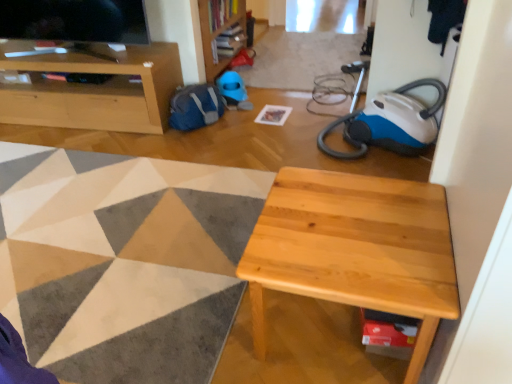
Question: Is wooden bookshelf at upper center smaller than matte wood cabinet at upper left?

Choices:
 (A) yes
 (B) no

Answer: (A)

Question: From a real-world perspective, does wooden bookshelf at upper center stand above matte wood cabinet at upper left?

Choices:
 (A) yes
 (B) no

Answer: (A)

Question: From the image's perspective, would you say wooden bookshelf at upper center is positioned over matte wood cabinet at upper left?

Choices:
 (A) yes
 (B) no

Answer: (A)

Question: Does wooden bookshelf at upper center have a lesser width compared to matte wood cabinet at upper left?

Choices:
 (A) yes
 (B) no

Answer: (A)

Question: Is wooden bookshelf at upper center taller than matte wood cabinet at upper left?

Choices:
 (A) yes
 (B) no

Answer: (A)

Question: In terms of height, does natural wood table at center look taller or shorter compared to matte wood cabinet at upper left?

Choices:
 (A) short
 (B) tall

Answer: (A)

Question: Is point (376, 301) positioned closer to the camera than point (161, 94)?

Choices:
 (A) farther
 (B) closer

Answer: (B)

Question: Based on their sizes in the image, would you say natural wood table at center is bigger or smaller than matte wood cabinet at upper left?

Choices:
 (A) small
 (B) big

Answer: (A)

Question: Choose the correct answer: Is natural wood table at center inside matte wood cabinet at upper left or outside it?

Choices:
 (A) outside
 (B) inside

Answer: (A)

Question: Choose the correct answer: Is wooden bookshelf at upper center inside matte wood cabinet at upper left or outside it?

Choices:
 (A) outside
 (B) inside

Answer: (A)

Question: Is wooden bookshelf at upper center bigger or smaller than matte wood cabinet at upper left?

Choices:
 (A) big
 (B) small

Answer: (B)

Question: In terms of height, does wooden bookshelf at upper center look taller or shorter compared to matte wood cabinet at upper left?

Choices:
 (A) tall
 (B) short

Answer: (A)

Question: Considering the relative positions of wooden bookshelf at upper center and matte wood cabinet at upper left in the image provided, is wooden bookshelf at upper center to the left or to the right of matte wood cabinet at upper left?

Choices:
 (A) left
 (B) right

Answer: (B)

Question: Would you say white paper at center is inside or outside wooden bookshelf at upper center?

Choices:
 (A) inside
 (B) outside

Answer: (B)

Question: In terms of size, does white paper at center appear bigger or smaller than wooden bookshelf at upper center?

Choices:
 (A) small
 (B) big

Answer: (A)